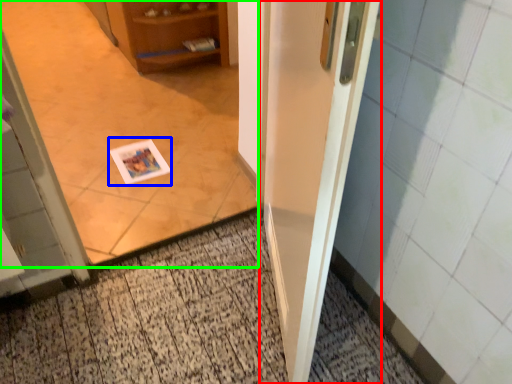
Question: Which object is the farthest from door (highlighted by a red box)? Choose among these: postcard (highlighted by a blue box) or corridor (highlighted by a green box).

Choices:
 (A) postcard
 (B) corridor

Answer: (A)